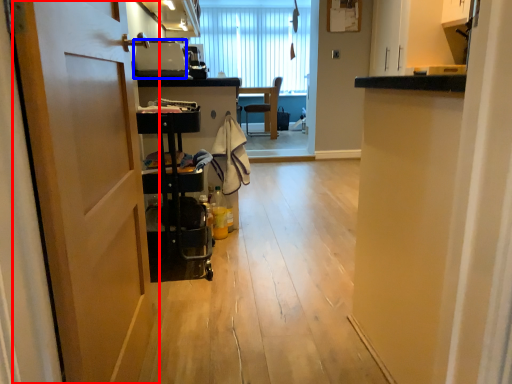
Question: Which of the following is the closest to the observer, door (highlighted by a red box) or appliance (highlighted by a blue box)?

Choices:
 (A) door
 (B) appliance

Answer: (A)